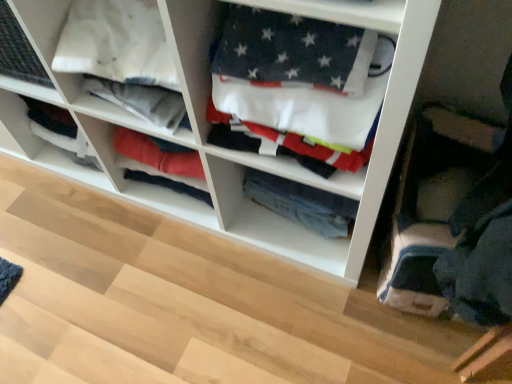
Question: From the image's perspective, would you say white cotton flag at center, which is the 2th clothing in back-to-front order, is shown under white fabric at center?

Choices:
 (A) yes
 (B) no

Answer: (A)

Question: Considering the relative sizes of white cotton flag at center, which is the 2th clothing in back-to-front order, and white fabric at center in the image provided, is white cotton flag at center, which is the 2th clothing in back-to-front order, wider than white fabric at center?

Choices:
 (A) yes
 (B) no

Answer: (B)

Question: Could you tell me if white cotton flag at center, the 1th clothing in the front-to-back sequence, is turned towards white fabric at center?

Choices:
 (A) no
 (B) yes

Answer: (B)

Question: From a real-world perspective, is white cotton flag at center, the 1th clothing in the front-to-back sequence, over white fabric at center?

Choices:
 (A) no
 (B) yes

Answer: (B)

Question: Is the position of white cotton flag at center, which is the 2th clothing in back-to-front order, less distant than that of white fabric at center?

Choices:
 (A) yes
 (B) no

Answer: (B)

Question: Would you say white cotton flag at center, the 1th clothing in the front-to-back sequence, is outside white fabric at center?

Choices:
 (A) no
 (B) yes

Answer: (A)

Question: Does white cotton flag at center, which is the 2th clothing in back-to-front order, have a lesser height compared to denim jeans at center, arranged as the 1th clothing when viewed from the back?

Choices:
 (A) yes
 (B) no

Answer: (B)

Question: Is denim jeans at center, arranged as the 1th clothing when viewed from the back, inside white cotton flag at center, the 1th clothing in the front-to-back sequence?

Choices:
 (A) yes
 (B) no

Answer: (B)

Question: Does white cotton flag at center, the 1th clothing in the front-to-back sequence, turn towards denim jeans at center, the second clothing in the front-to-back sequence?

Choices:
 (A) yes
 (B) no

Answer: (B)

Question: Is white cotton flag at center, which is the 2th clothing in back-to-front order, wider than denim jeans at center, arranged as the 1th clothing when viewed from the back?

Choices:
 (A) yes
 (B) no

Answer: (A)

Question: Is there a large distance between white cotton flag at center, which is the 2th clothing in back-to-front order, and denim jeans at center, the second clothing in the front-to-back sequence?

Choices:
 (A) no
 (B) yes

Answer: (A)

Question: Is white cotton flag at center, which is the 2th clothing in back-to-front order, to the right of denim jeans at center, the second clothing in the front-to-back sequence, from the viewer's perspective?

Choices:
 (A) yes
 (B) no

Answer: (B)

Question: Is denim jeans at center, the second clothing in the front-to-back sequence, located within white fabric at center?

Choices:
 (A) no
 (B) yes

Answer: (B)